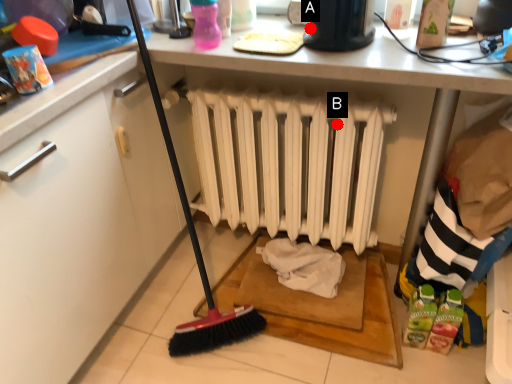
Question: Two points are circled on the image, labeled by A and B beside each circle. Which point is closer to the camera taking this photo?

Choices:
 (A) A is closer
 (B) B is closer

Answer: (A)